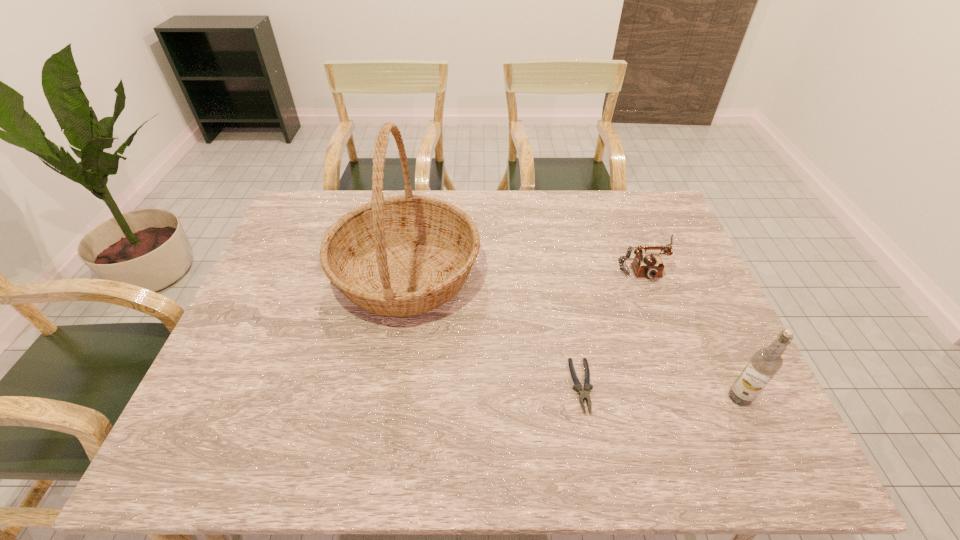
Find the location of a particular element. The image size is (960, 540). basket is located at coordinates (405, 255).

You are a GUI agent. You are given a task and a screenshot of the screen. Output one action in this format:
    pyautogui.click(x=<x>, y=<y>)
    Task: Click on the tallest object
    This screenshot has width=960, height=540.
    Given the screenshot: What is the action you would take?
    pyautogui.click(x=405, y=255)

Locate an element on the screen. vodka is located at coordinates (766, 362).

Image resolution: width=960 pixels, height=540 pixels. Identify the location of telephone. (651, 266).

I want to click on the second object from left to right, so click(x=584, y=391).

You are a GUI agent. You are given a task and a screenshot of the screen. Output one action in this format:
    pyautogui.click(x=<x>, y=<y>)
    Task: Click on the shortest object
    This screenshot has height=540, width=960.
    Given the screenshot: What is the action you would take?
    pyautogui.click(x=584, y=391)

Locate an element on the screen. vacant region located on the back of the leftmost object is located at coordinates click(x=417, y=210).

You are a GUI agent. You are given a task and a screenshot of the screen. Output one action in this format:
    pyautogui.click(x=<x>, y=<y>)
    Task: Click on the vacant region located 0.280m on the label of the vodka
    The height and width of the screenshot is (540, 960).
    Given the screenshot: What is the action you would take?
    pyautogui.click(x=604, y=397)

The image size is (960, 540). I want to click on free space located 0.160m on the label of the vodka, so click(x=658, y=397).

Where is `free spot located 0.300m on the label of the vodka`? This screenshot has width=960, height=540. free spot located 0.300m on the label of the vodka is located at coordinates (595, 397).